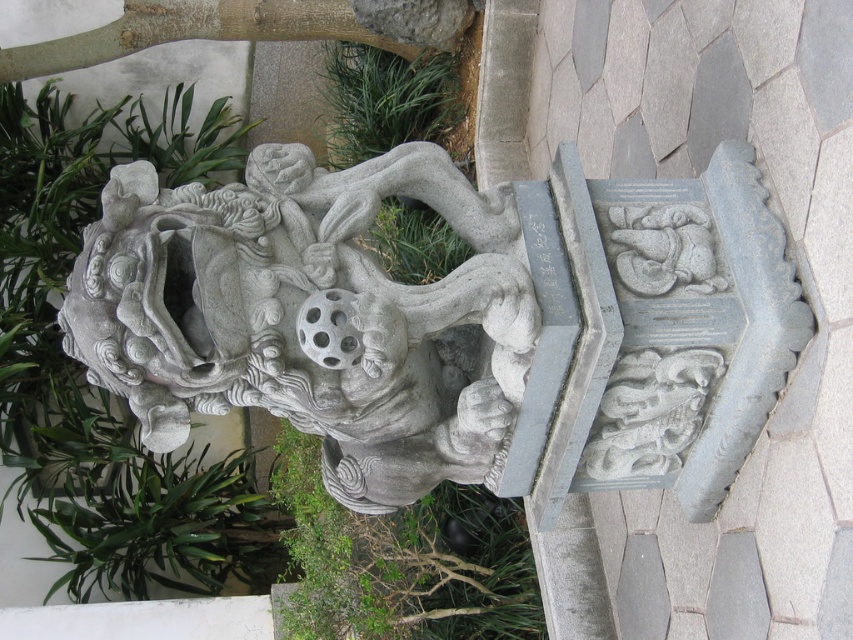
Question: Which object is closer to the camera taking this photo?

Choices:
 (A) gray stone lion at left
 (B) green grass at upper center
 (C) green leafy plant at center

Answer: (A)

Question: Is gray stone lion at left bigger than green leafy plant at center?

Choices:
 (A) yes
 (B) no

Answer: (B)

Question: Which object is closer to the camera taking this photo?

Choices:
 (A) gray stone lion at left
 (B) green leafy plant at center

Answer: (A)

Question: In this image, where is gray stone lion at left located relative to green grass at upper center?

Choices:
 (A) left
 (B) right

Answer: (B)

Question: Is green leafy plant at center thinner than green grass at upper center?

Choices:
 (A) yes
 (B) no

Answer: (B)

Question: Which object appears closest to the camera in this image?

Choices:
 (A) gray stone lion at left
 (B) green leafy plant at center
 (C) green grass at upper center

Answer: (A)